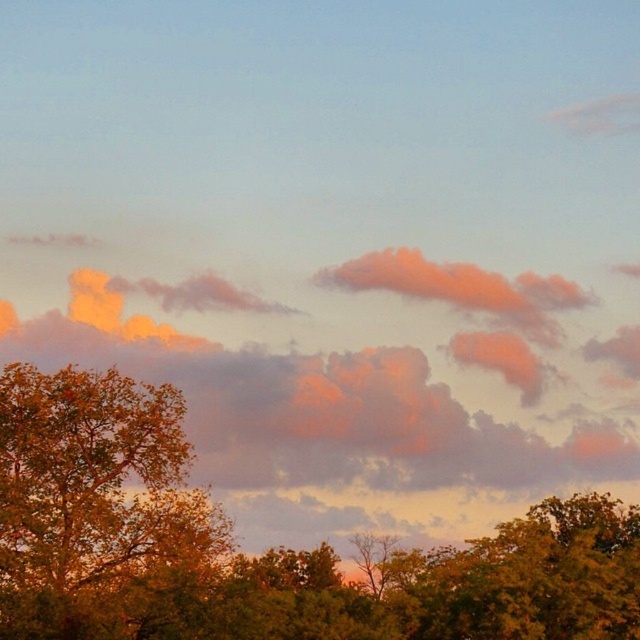
In the scene shown: Can you confirm if green leafy tree at center is positioned to the left of green leafy tree at lower right?

Correct, you'll find green leafy tree at center to the left of green leafy tree at lower right.

Who is more forward, (x=1, y=611) or (x=596, y=529)?

Point (x=1, y=611) is in front.

Identify the location of green leafy tree at center. (264, 552).

Does green leafy tree at center have a larger size compared to orange cotton clouds at center?

Yes.

Which is behind, point (275, 598) or point (600, 477)?

Positioned behind is point (600, 477).

Which is in front, point (76, 502) or point (525, 477)?

Point (76, 502) is more forward.

Where is `green leafy tree at center`? The width and height of the screenshot is (640, 640). green leafy tree at center is located at coordinates (264, 552).

Measure the distance from golden textured leaves at left to green leafy tree at lower right.

golden textured leaves at left is 8.18 meters away from green leafy tree at lower right.

Is point (124, 518) farther from viewer compared to point (580, 612)?

Yes.

Measure the distance between golden textured leaves at left and camera.

golden textured leaves at left is 54.80 meters from camera.

Locate an element on the screen. This screenshot has height=640, width=640. golden textured leaves at left is located at coordinates point(93,502).